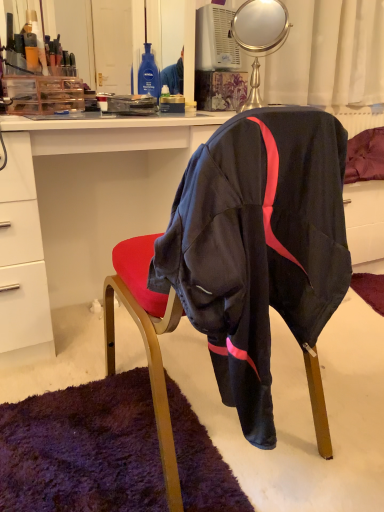
Question: Is white glossy desk at center bigger than metallic gold mirror at upper center?

Choices:
 (A) no
 (B) yes

Answer: (B)

Question: From the image's perspective, is white glossy desk at center on top of metallic gold mirror at upper center?

Choices:
 (A) yes
 (B) no

Answer: (B)

Question: Is metallic gold mirror at upper center inside white glossy desk at center?

Choices:
 (A) no
 (B) yes

Answer: (A)

Question: Is white glossy desk at center taller than metallic gold mirror at upper center?

Choices:
 (A) yes
 (B) no

Answer: (A)

Question: Is white glossy desk at center turned away from metallic gold mirror at upper center?

Choices:
 (A) no
 (B) yes

Answer: (A)

Question: Considering the positions of metallic gold mirror at upper center and black fabric chair at center in the image, is metallic gold mirror at upper center wider or thinner than black fabric chair at center?

Choices:
 (A) thin
 (B) wide

Answer: (A)

Question: Considering their positions, is metallic gold mirror at upper center located in front of or behind black fabric chair at center?

Choices:
 (A) behind
 (B) front

Answer: (A)

Question: From the image's perspective, is metallic gold mirror at upper center above or below black fabric chair at center?

Choices:
 (A) above
 (B) below

Answer: (A)

Question: From their relative heights in the image, would you say metallic gold mirror at upper center is taller or shorter than black fabric chair at center?

Choices:
 (A) tall
 (B) short

Answer: (B)

Question: Is point (244, 123) closer or farther from the camera than point (251, 12)?

Choices:
 (A) closer
 (B) farther

Answer: (A)

Question: Would you say black fabric chair at center is to the left or to the right of metallic gold mirror at upper center in the picture?

Choices:
 (A) right
 (B) left

Answer: (B)

Question: In terms of width, does black fabric chair at center look wider or thinner when compared to metallic gold mirror at upper center?

Choices:
 (A) wide
 (B) thin

Answer: (A)

Question: Based on their sizes in the image, would you say black fabric chair at center is bigger or smaller than metallic gold mirror at upper center?

Choices:
 (A) small
 (B) big

Answer: (B)

Question: Is point (251, 10) positioned closer to the camera than point (21, 203)?

Choices:
 (A) farther
 (B) closer

Answer: (A)

Question: From a real-world perspective, is metallic gold mirror at upper center physically located above or below white glossy desk at center?

Choices:
 (A) above
 (B) below

Answer: (A)